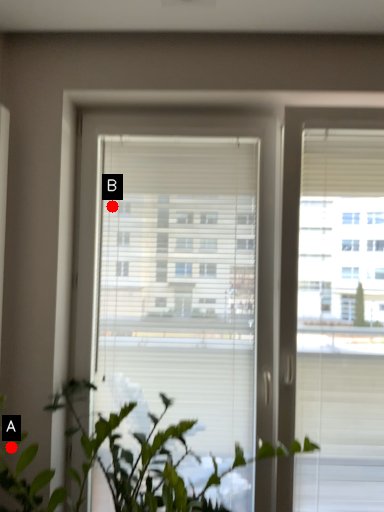
Question: Two points are circled on the image, labeled by A and B beside each circle. Which point is closer to the camera?

Choices:
 (A) A is closer
 (B) B is closer

Answer: (A)